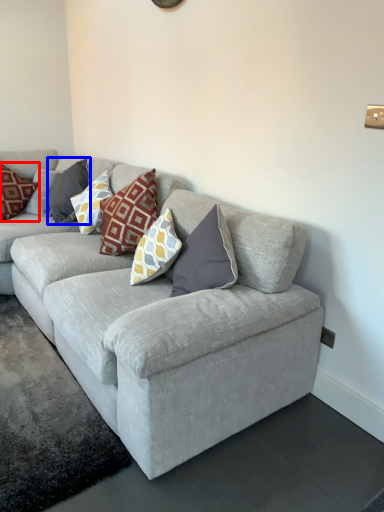
Question: Which object is further to the camera taking this photo, pillow (highlighted by a red box) or pillow (highlighted by a blue box)?

Choices:
 (A) pillow
 (B) pillow

Answer: (A)